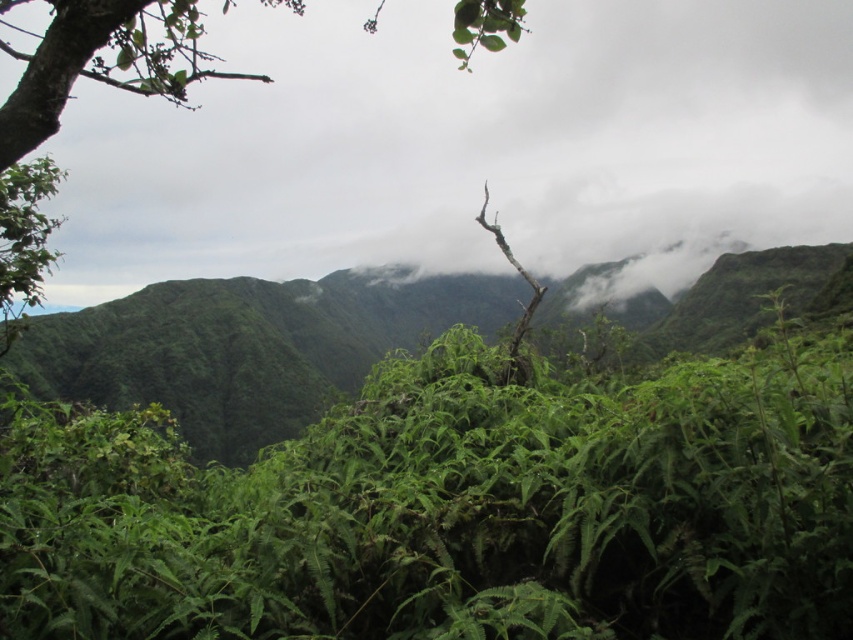
Question: Which point appears farthest from the camera in this image?

Choices:
 (A) (265, 76)
 (B) (149, 632)

Answer: (A)

Question: Does green leafy shrubs at center have a lesser width compared to green leafy tree at upper center?

Choices:
 (A) no
 (B) yes

Answer: (B)

Question: Can you confirm if green leafy shrubs at center is positioned to the right of green leafy tree at upper center?

Choices:
 (A) yes
 (B) no

Answer: (A)

Question: Can you confirm if green leafy shrubs at center is positioned to the right of green leafy tree at upper center?

Choices:
 (A) no
 (B) yes

Answer: (B)

Question: Which of the following is the farthest from the observer?

Choices:
 (A) (595, 460)
 (B) (73, 29)

Answer: (A)